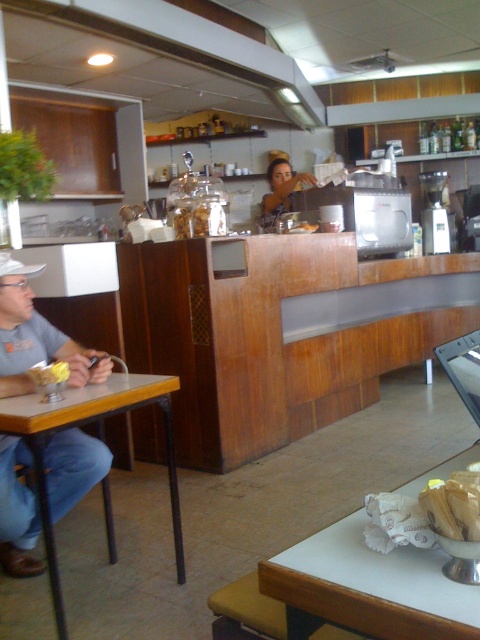
Is matte gray shirt at left behind yellow matte butter at table left?

Yes, matte gray shirt at left is behind yellow matte butter at table left.

Is point (66, 349) positioned after point (33, 376)?

Yes, point (66, 349) is farther from viewer.

Image resolution: width=480 pixels, height=640 pixels. I want to click on matte gray shirt at left, so click(x=36, y=337).

Which is behind, point (475, 612) or point (44, 378)?

Positioned behind is point (44, 378).

From the picture: Which is more to the left, white glossy table at lower right or yellow matte butter at table left?

yellow matte butter at table left

Is point (383, 605) positioned after point (34, 378)?

No.

This screenshot has width=480, height=640. Identify the location of white glossy table at lower right. (369, 588).

Can you confirm if white glossy table at lower right is taller than matte gray shirt at left?

No, white glossy table at lower right is not taller than matte gray shirt at left.

You are a GUI agent. You are given a task and a screenshot of the screen. Output one action in this format:
    pyautogui.click(x=<x>, y=<y>)
    Task: Click on the white glossy table at lower right
    The width and height of the screenshot is (480, 640).
    Given the screenshot: What is the action you would take?
    pyautogui.click(x=369, y=588)